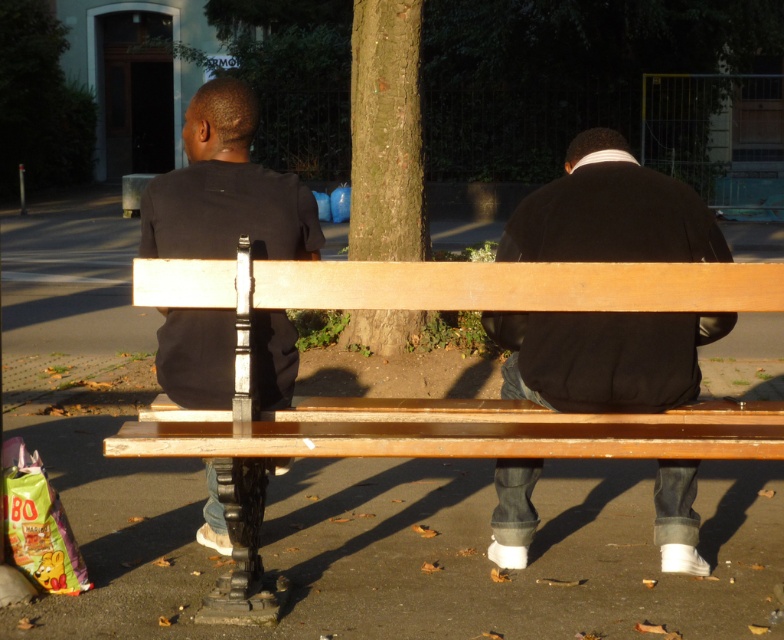
You are standing at the point labeled point (559,198) and want to walk to the point labeled point (514,496). Which direction should you face to move directly towards your destination?

Since point (559,198) is in front of point (514,496), you should face backward to move directly towards point (514,496).